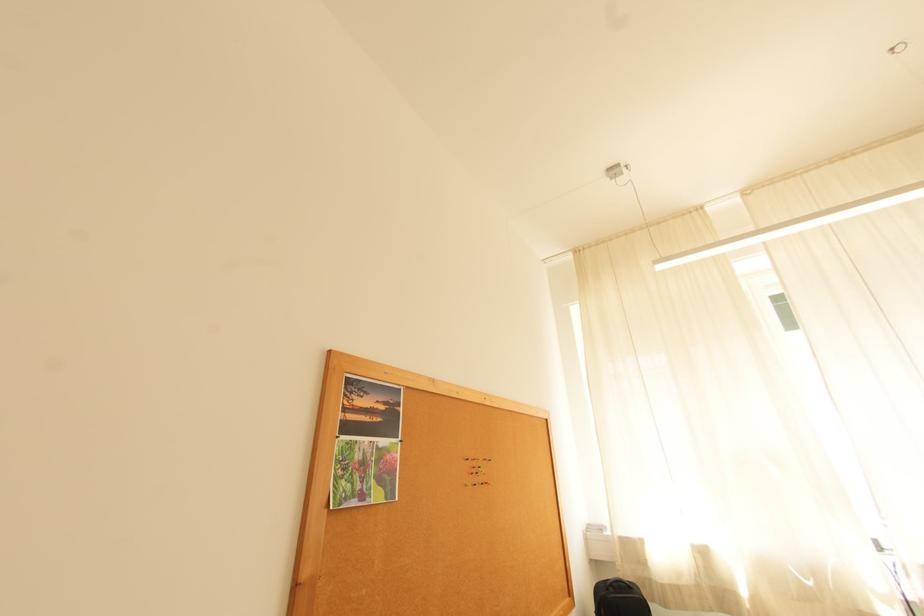
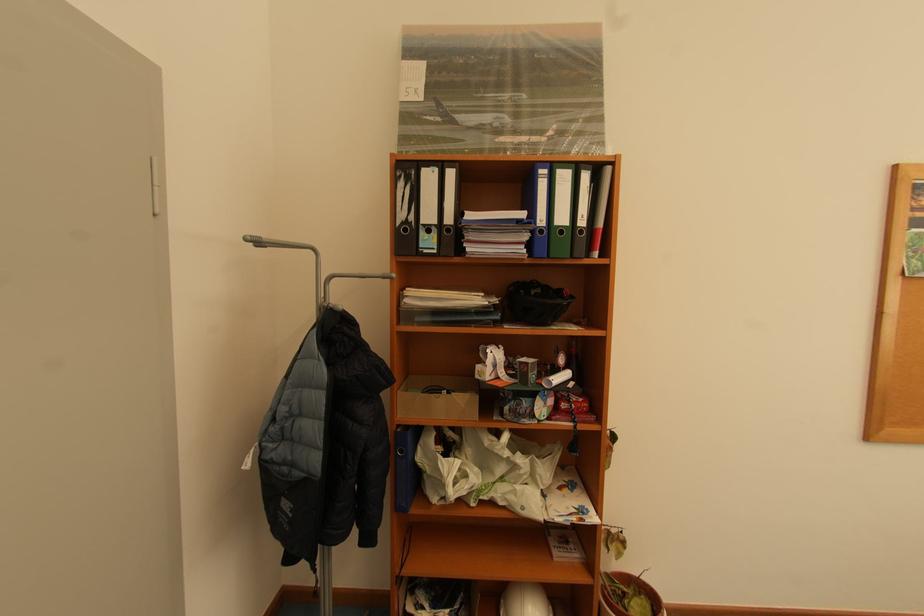
Locate, in the second image, the point that corresponds to the point at 338,353 in the first image.

(904, 167)